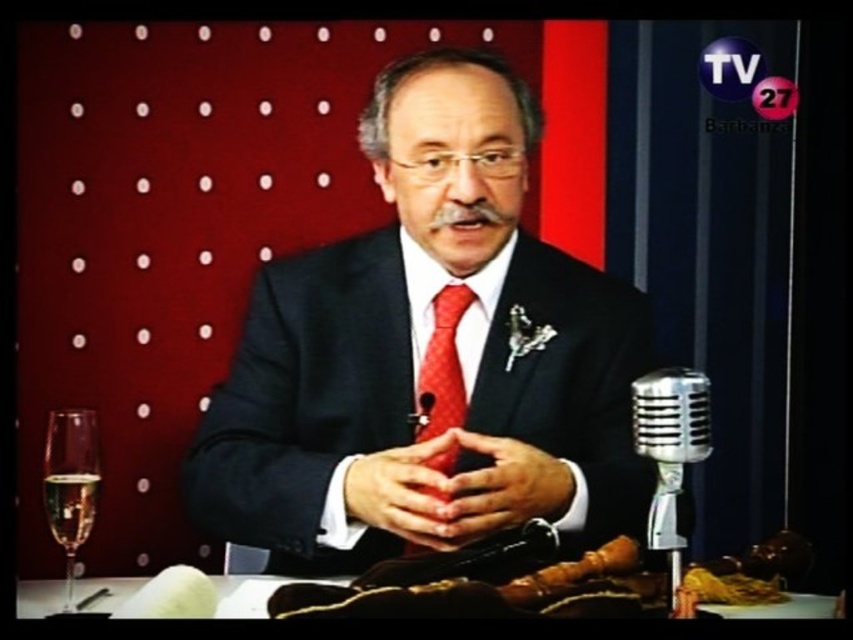
Is silver metallic microphone at lower right behind shiny silk tie at center?

No, it is in front of shiny silk tie at center.

Is silver metallic microphone at lower right taller than shiny silk tie at center?

No, silver metallic microphone at lower right is not taller than shiny silk tie at center.

Where is `silver metallic microphone at lower right`? silver metallic microphone at lower right is located at coordinates (670, 449).

Image resolution: width=853 pixels, height=640 pixels. I want to click on silver metallic microphone at lower right, so click(670, 449).

Is matte red heart at center bigger than clear glass wine glass at lower left?

Yes, matte red heart at center is bigger than clear glass wine glass at lower left.

Can you confirm if matte red heart at center is smaller than clear glass wine glass at lower left?

Actually, matte red heart at center might be larger than clear glass wine glass at lower left.

Where is `matte red heart at center`? This screenshot has height=640, width=853. matte red heart at center is located at coordinates (408, 493).

Find the location of a particular element. This screenshot has height=640, width=853. matte red heart at center is located at coordinates (408, 493).

Measure the distance from matte black hands at center to white fabric table at lower center.

matte black hands at center and white fabric table at lower center are 10.90 inches apart from each other.

Is point (550, 508) farther from viewer compared to point (105, 584)?

No, it is not.

Who is more distant from viewer, (462, 518) or (128, 595)?

The point (128, 595) is more distant.

This screenshot has height=640, width=853. I want to click on matte black hands at center, so 502,486.